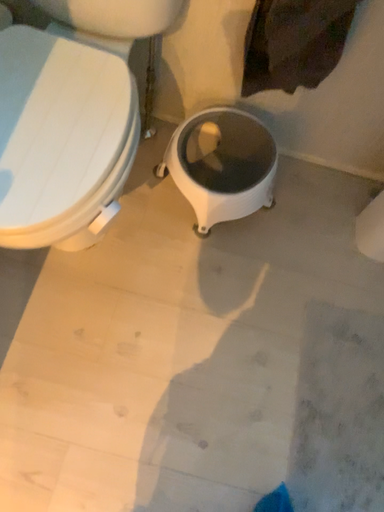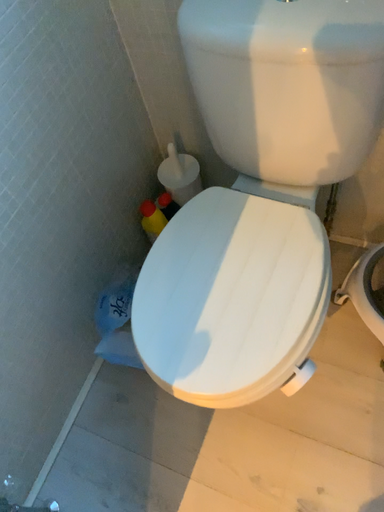
Question: How did the camera likely rotate when shooting the video?

Choices:
 (A) rotated upward
 (B) rotated downward

Answer: (A)